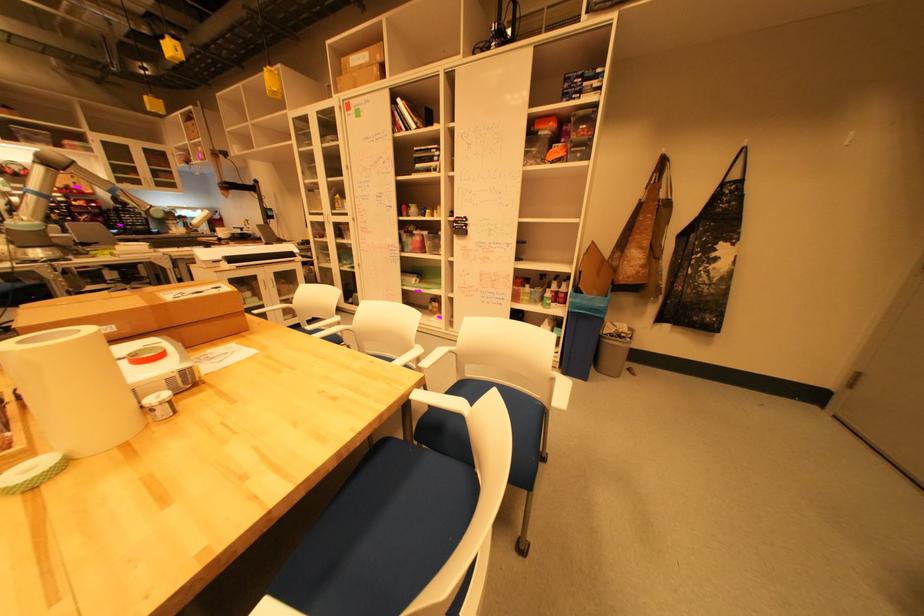
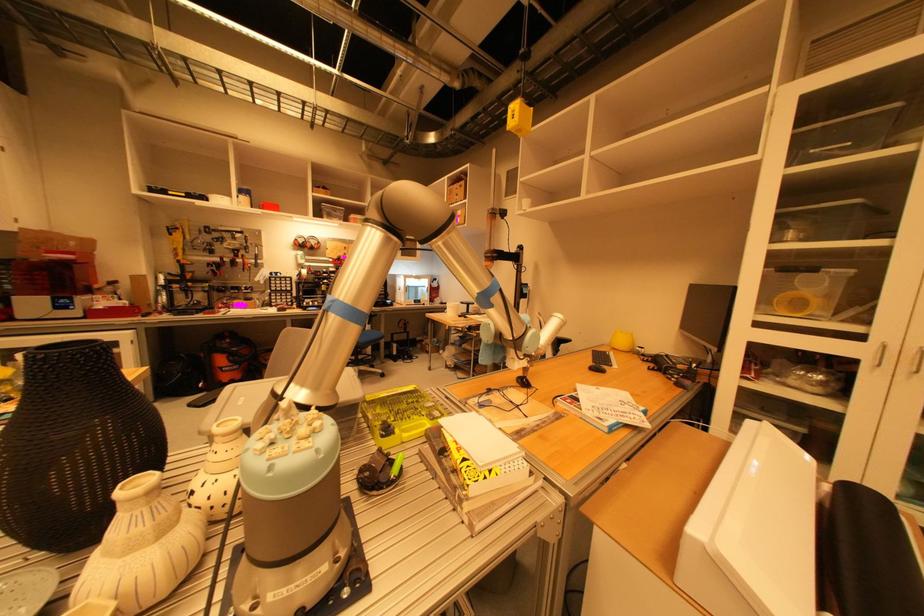
In the scene shown: The images are taken continuously from a first-person perspective. In which direction are you moving?

The cameraman walked toward left, forward.